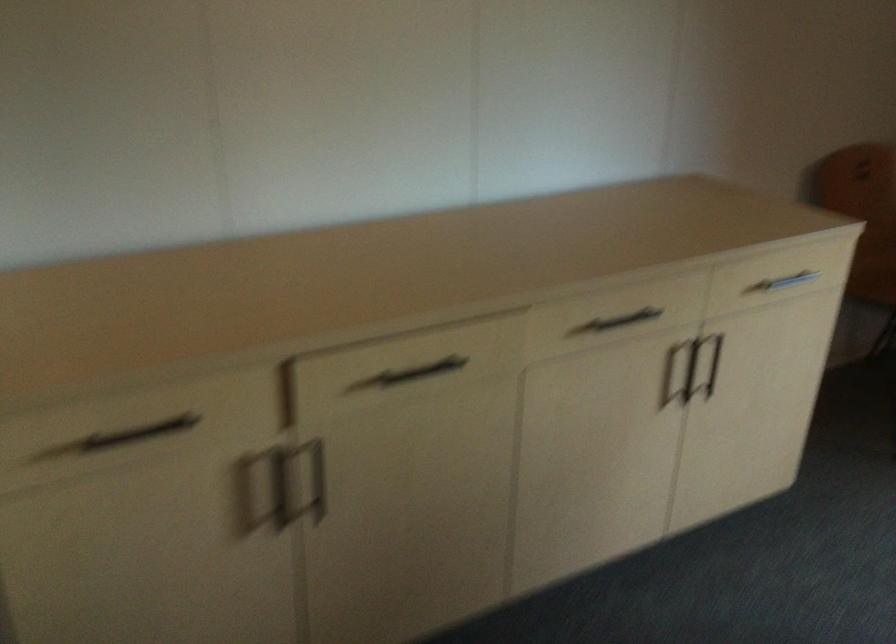
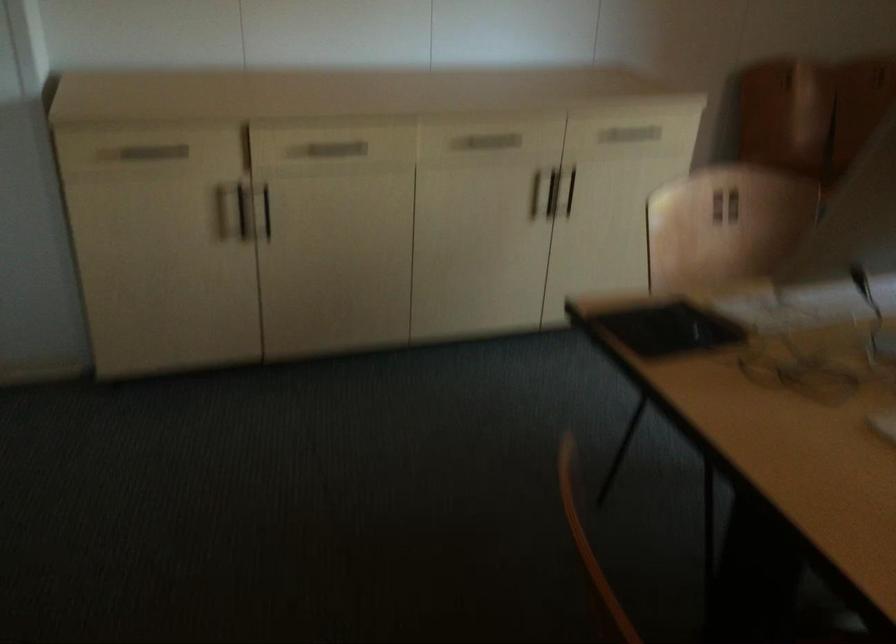
Find the pixel in the second image that matches the point at 320,476 in the first image.

(264, 211)